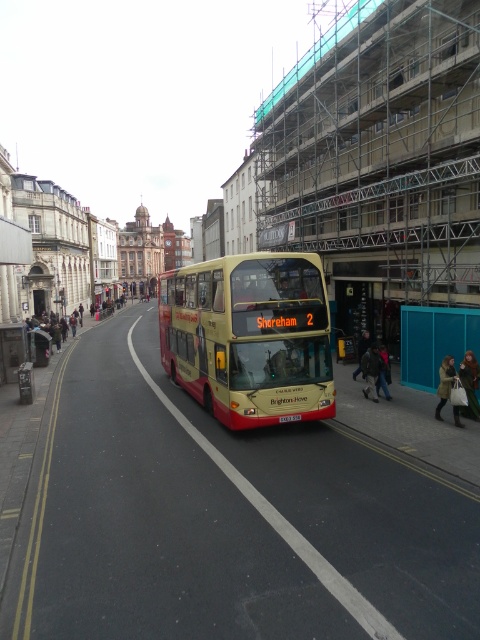
Who is more forward, [468,369] or [367,352]?

Point [468,369] is more forward.

Is green fabric coat at center above dark brown leather jacket at lower right?

Actually, green fabric coat at center is below dark brown leather jacket at lower right.

Does point (471, 365) come closer to viewer compared to point (377, 360)?

That is True.

Find the location of a particular element. green fabric coat at center is located at coordinates (469, 385).

I want to click on green fabric coat at center, so click(469, 385).

Which is behind, point (472, 360) or point (455, 404)?

The point (472, 360) is more distant.

Locate an element on the screen. This screenshot has width=480, height=640. green fabric coat at center is located at coordinates (469, 385).

Which of these two, yellow matte/decorative decker bus at center or teal fabric coat at lower right, stands taller?

With more height is yellow matte/decorative decker bus at center.

Is yellow matte/decorative decker bus at center shorter than teal fabric coat at lower right?

Incorrect, yellow matte/decorative decker bus at center's height does not fall short of teal fabric coat at lower right's.

Does point (224, 320) come farther from viewer compared to point (456, 412)?

No, it is not.

Find the location of `yellow matte/decorative decker bus at center`. yellow matte/decorative decker bus at center is located at coordinates (250, 337).